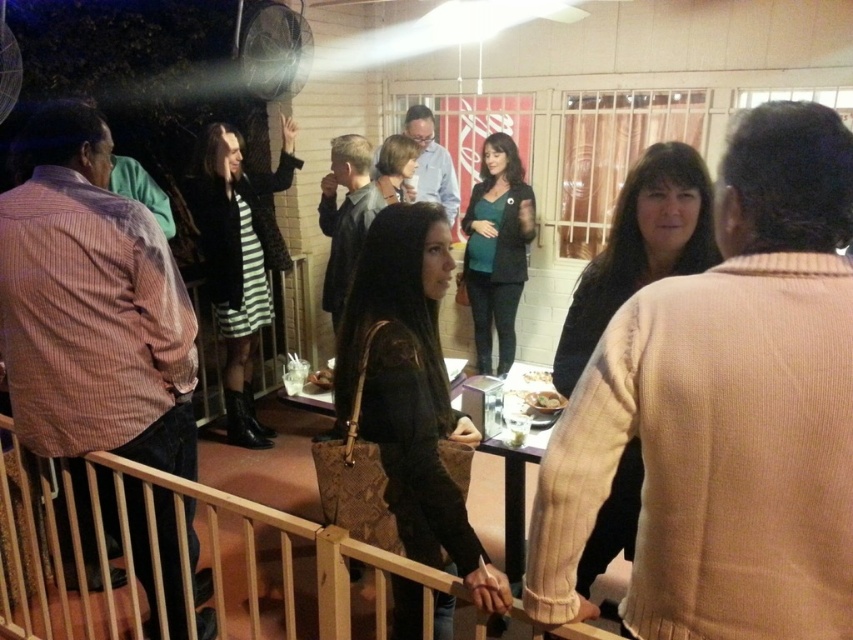
Can you confirm if striped fabric dress at center is positioned above matte black blazer at center?

No.

Does striped fabric dress at center come behind matte black blazer at center?

No.

Locate an element on the screen. This screenshot has width=853, height=640. striped fabric dress at center is located at coordinates (236, 260).

This screenshot has height=640, width=853. Identify the location of striped fabric dress at center. (236, 260).

From the picture: Does striped fabric dress at center have a smaller size compared to smooth brown bowl at center?

No, striped fabric dress at center is not smaller than smooth brown bowl at center.

Between striped fabric dress at center and smooth brown bowl at center, which one has less height?

smooth brown bowl at center

Which is in front, point (236, 193) or point (547, 378)?

Point (547, 378) is in front.

Image resolution: width=853 pixels, height=640 pixels. I want to click on striped fabric dress at center, so click(x=236, y=260).

Find the location of a particular element. leather handbag at center is located at coordinates (410, 390).

Between leather handbag at center and shiny plastic bowl at center, which one has more height?

With more height is leather handbag at center.

Is point (468, 438) positioned before point (556, 406)?

Yes, point (468, 438) is in front of point (556, 406).

Identify the location of leather handbag at center. (410, 390).